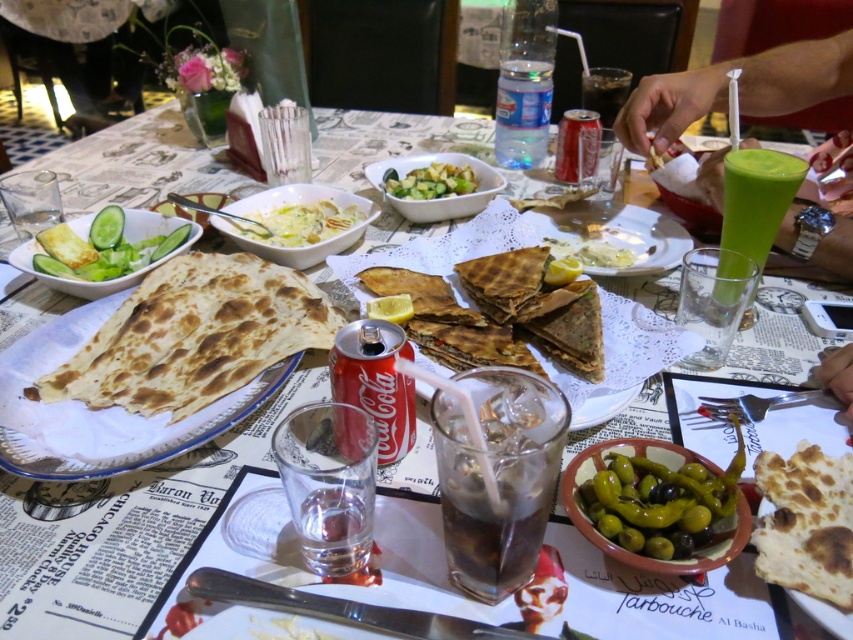
You are a server at a restaurant trying to place a new dish on the table. The dish requires a surface wider than the white ceramic plate at center. Can you use the brown matte tortilla at center for this purpose?

The brown matte tortilla at center has a greater width than the white ceramic plate at center, so yes, you can use the brown matte tortilla at center as its width is sufficient for the dish.

You are a photographer trying to capture a closeup of the object at point (141,358) and the object at point (556,252). Which object will appear larger in your photo?

The object at point (141,358) will appear larger in the photo because it is closer to the camera than the object at point (556,252).

You are a customer at this restaurant and want to reach for the green smoothie at right and the white creamy soup at center. Which one is closer to your right hand?

The green smoothie at right is to the right of white creamy soup at center, so it is closer to your right hand.